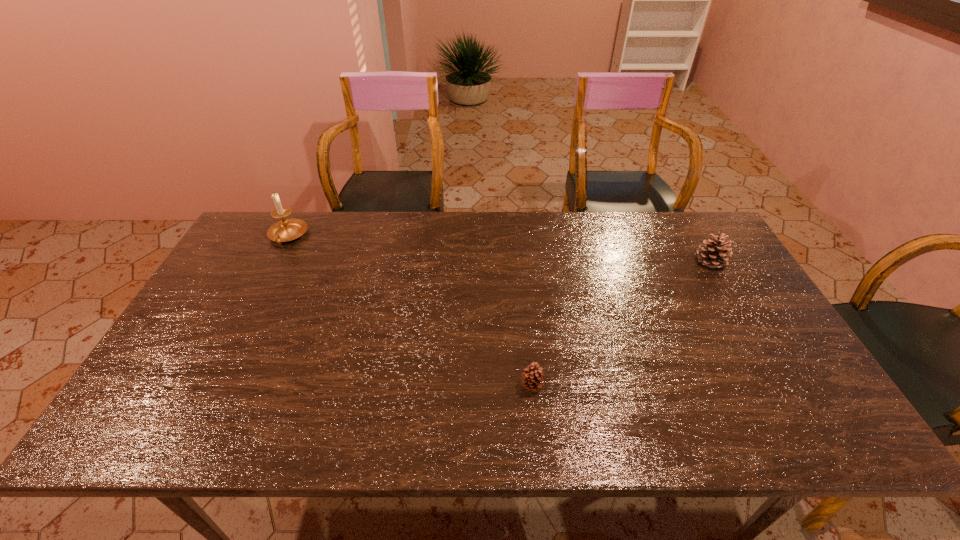
Locate an element on the screen. This screenshot has width=960, height=540. the farthest object is located at coordinates (285, 230).

The width and height of the screenshot is (960, 540). Find the location of `candle holder`. candle holder is located at coordinates (285, 230).

Find the location of a particular element. Image resolution: width=960 pixels, height=540 pixels. the farther pinecone is located at coordinates (715, 254).

This screenshot has width=960, height=540. What are the coordinates of `the second farthest object` in the screenshot? It's located at (715, 254).

What are the coordinates of `the shortest object` in the screenshot? It's located at (531, 378).

Locate an element on the screen. Image resolution: width=960 pixels, height=540 pixels. the nearer pinecone is located at coordinates (531, 378).

What are the coordinates of `free spot located with a handle on the side of the candle holder` in the screenshot? It's located at (233, 341).

This screenshot has height=540, width=960. I want to click on vacant space located 0.110m on the front of the right pinecone, so click(732, 298).

Locate an element on the screen. vacant space located on the left of the nearer pinecone is located at coordinates (466, 386).

The image size is (960, 540). Find the location of `candle holder situated at the far edge`. candle holder situated at the far edge is located at coordinates (285, 230).